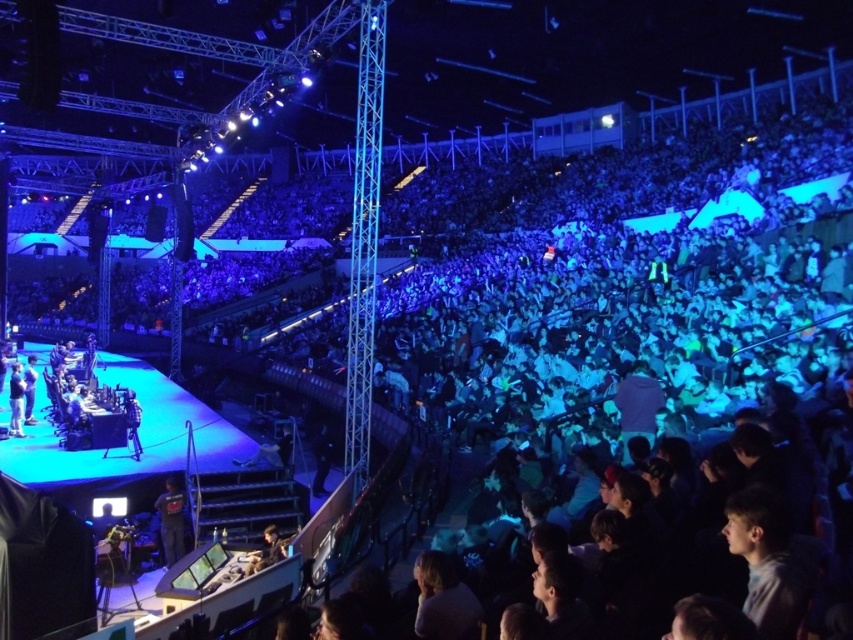
Question: Which of the following is the closest to the observer?

Choices:
 (A) (178, 532)
 (B) (282, 554)
 (C) (16, 426)

Answer: (B)

Question: Does dark gray hoodie at center appear under dark gray fabric jacket at stage left?

Choices:
 (A) no
 (B) yes

Answer: (B)

Question: Observing the image, what is the correct spatial positioning of dark gray hoodie at center in reference to dark blue fabric jacket at center?

Choices:
 (A) below
 (B) above

Answer: (A)

Question: Which object appears farthest from the camera in this image?

Choices:
 (A) dark gray fabric jacket at stage left
 (B) dark gray hoodie at center
 (C) dark blue fabric jacket at center
 (D) dark blue fabric jacket at lower center

Answer: (A)

Question: Does dark blue fabric jacket at lower center have a lesser width compared to dark gray fabric jacket at stage left?

Choices:
 (A) no
 (B) yes

Answer: (B)

Question: Estimate the real-world distances between objects in this image. Which object is farther from the dark gray fabric jacket at stage left?

Choices:
 (A) dark blue fabric jacket at lower center
 (B) dark blue fabric jacket at center

Answer: (A)